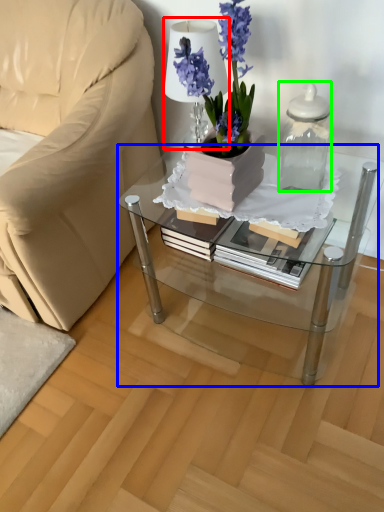
Question: Based on their relative distances, which object is farther from table lamp (highlighted by a red box)? Choose from coffee table (highlighted by a blue box) and vase (highlighted by a green box).

Choices:
 (A) coffee table
 (B) vase

Answer: (A)